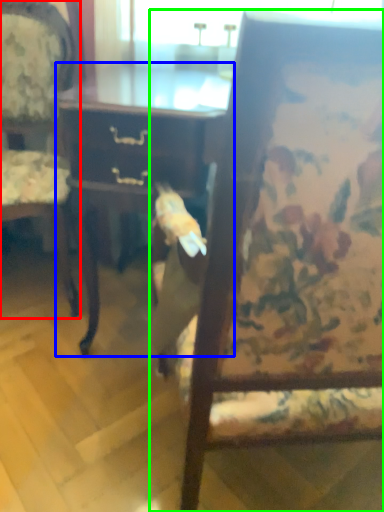
Question: Considering the real-world distances, which object is farthest from chair (highlighted by a red box)? desk (highlighted by a blue box) or chair (highlighted by a green box)?

Choices:
 (A) desk
 (B) chair

Answer: (B)